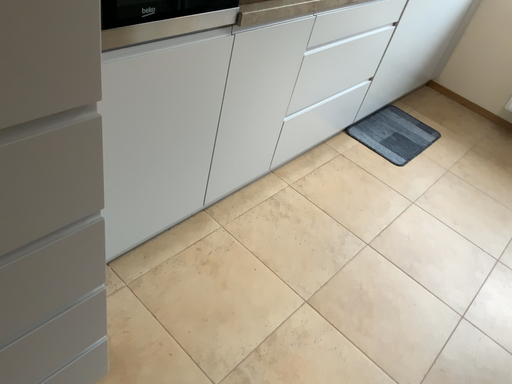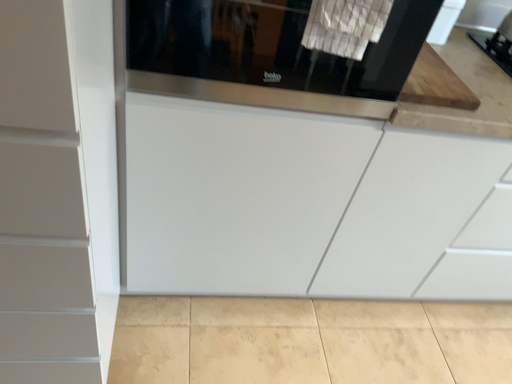
Question: Which way did the camera rotate in the video?

Choices:
 (A) rotated upward
 (B) rotated downward

Answer: (A)